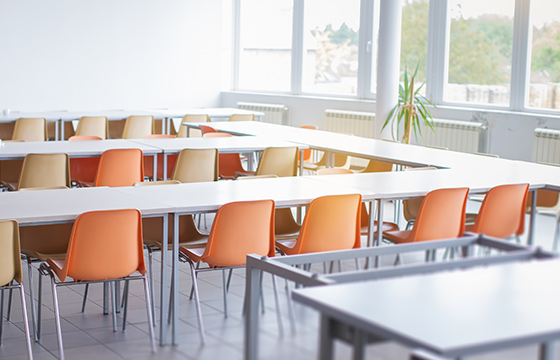
Where is `radiator`? This screenshot has width=560, height=360. radiator is located at coordinates (363, 131), (256, 111), (469, 136), (544, 146).